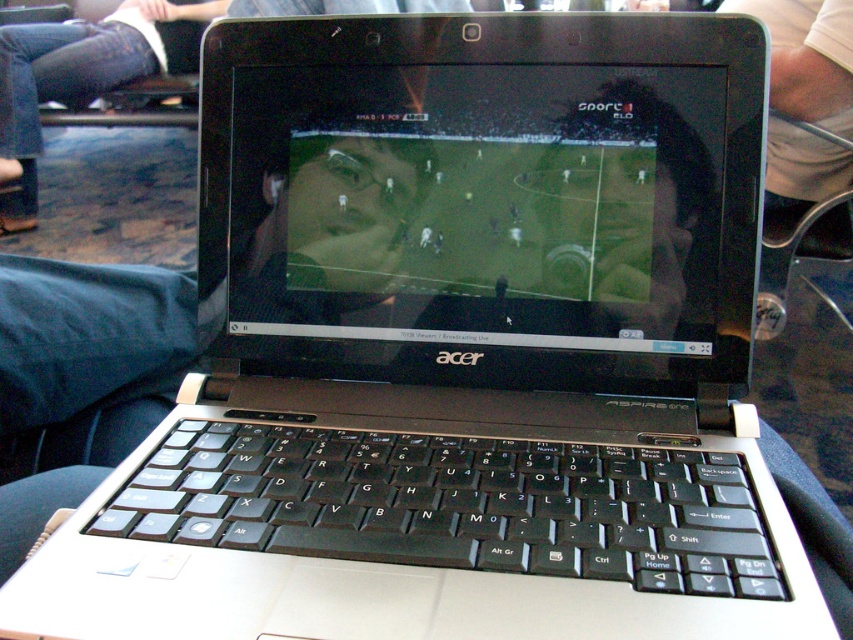
Does matte black laptop at center appear under blue jeans at lower left?

Yes.

Does point (585, 168) come behind point (113, 70)?

No.

Who is more distant from viewer, (368, 208) or (164, 67)?

The point (164, 67) is behind.

Locate an element on the screen. matte black laptop at center is located at coordinates (474, 209).